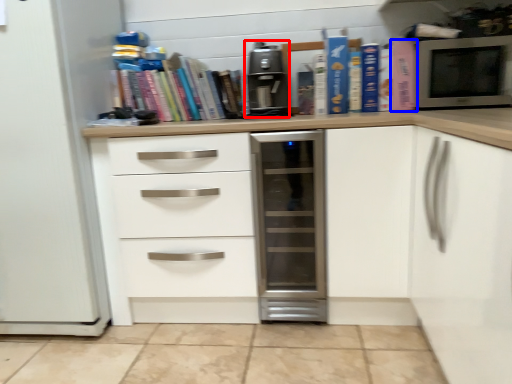
Question: Which object is closer to the camera taking this photo, coffee machine (highlighted by a red box) or paperback book (highlighted by a blue box)?

Choices:
 (A) coffee machine
 (B) paperback book

Answer: (A)